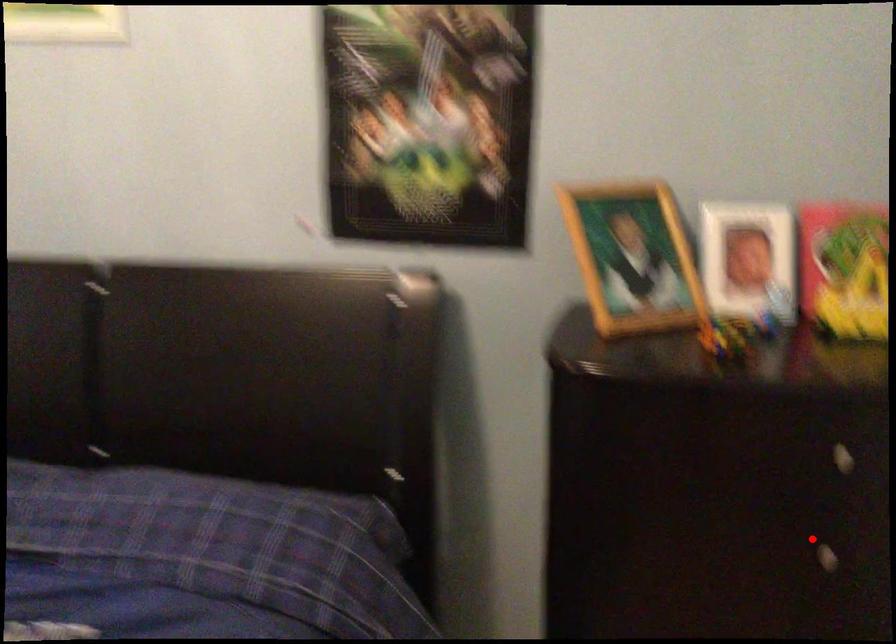
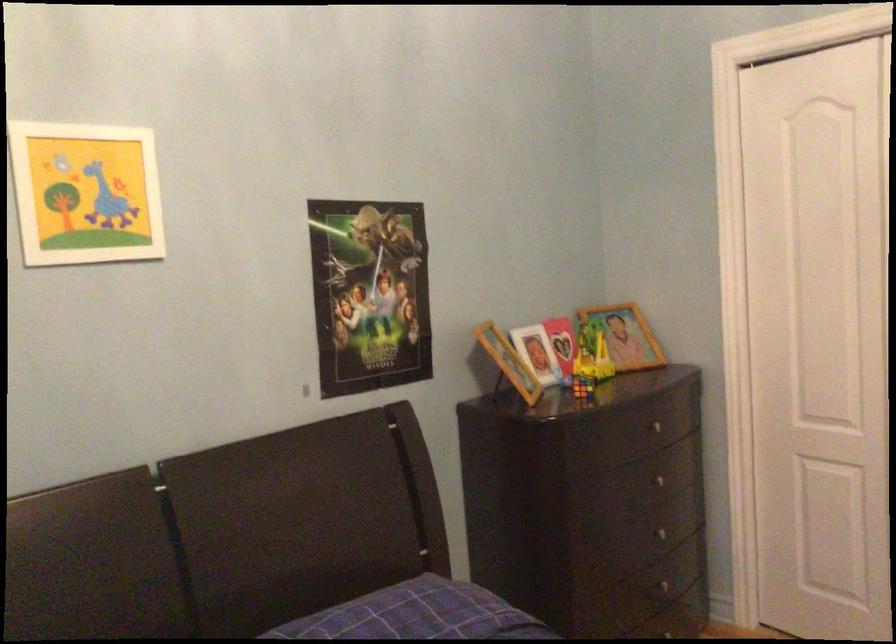
Where in the second image is the point corresponding to the highlighted location from the first image?

(656, 480)